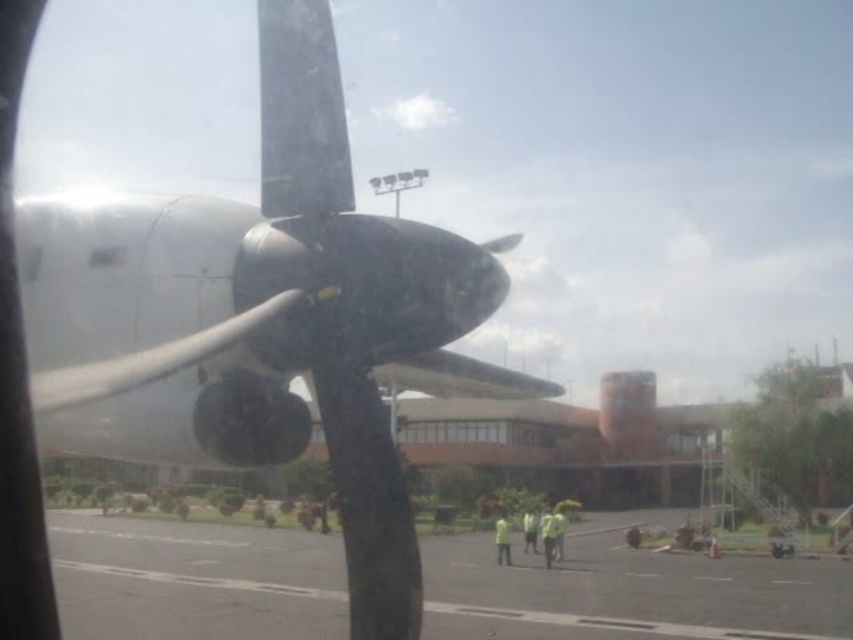
You are a passenger seated in the aircraft and looking out the window. You notice the polished silver propeller at center. Can you determine its exact position relative to the window frame using coordinates?

The polished silver propeller at center is located at point coordinates of 0.487 on the x axis and 0.299 on the y axis relative to the window frame.

In the scene shown: You are a pilot preparing for takeoff and need to check the propeller. From your seat inside the aircraft, which side of the gray asphalt tarmac at lower center should you look to locate the polished silver propeller at center?

The polished silver propeller at center is to the right of the gray asphalt tarmac at lower center, so you should look to the right side of the gray asphalt tarmac at lower center to locate it.

You are a pilot preparing for takeoff and need to check the visibility of the runway. You notice the polished silver propeller at center and the gray asphalt tarmac at lower center in your view. Which object takes up more space in your current view?

The gray asphalt tarmac at lower center takes up more space in the current view than the polished silver propeller at center.